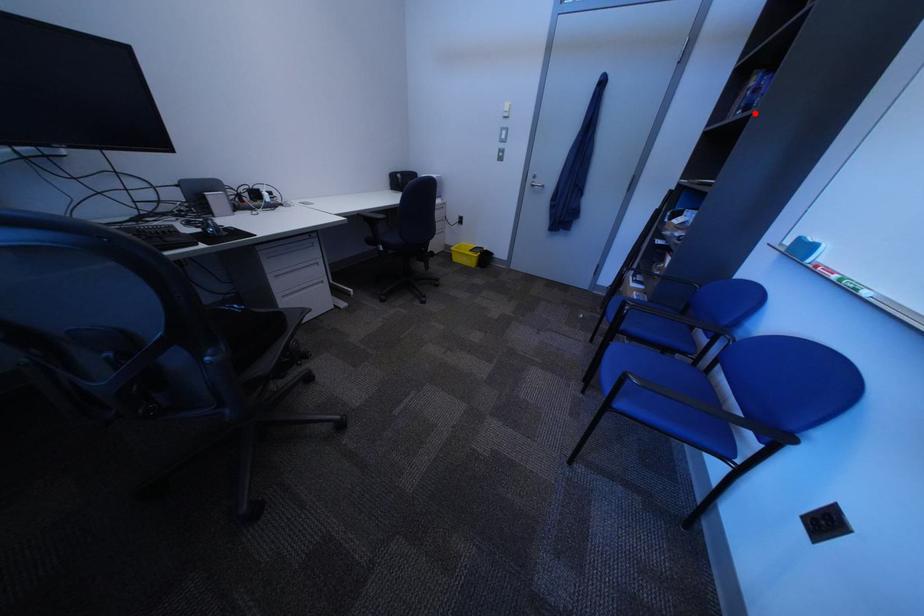
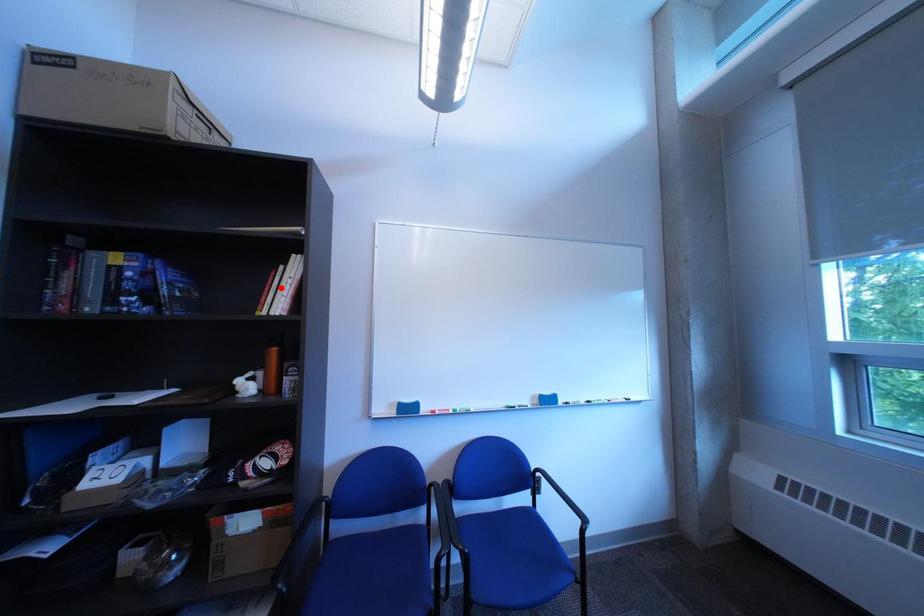
I am providing you with two images of the same scene from different viewpoints. A red point is marked on the first image and another point is marked on the second image. Is the red point in image1 aligned with the point shown in image2?

No